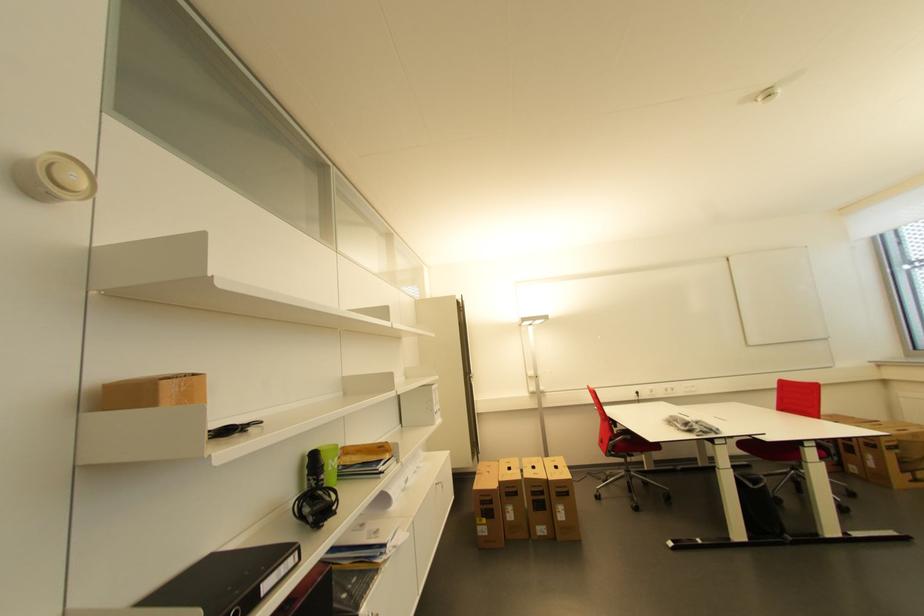
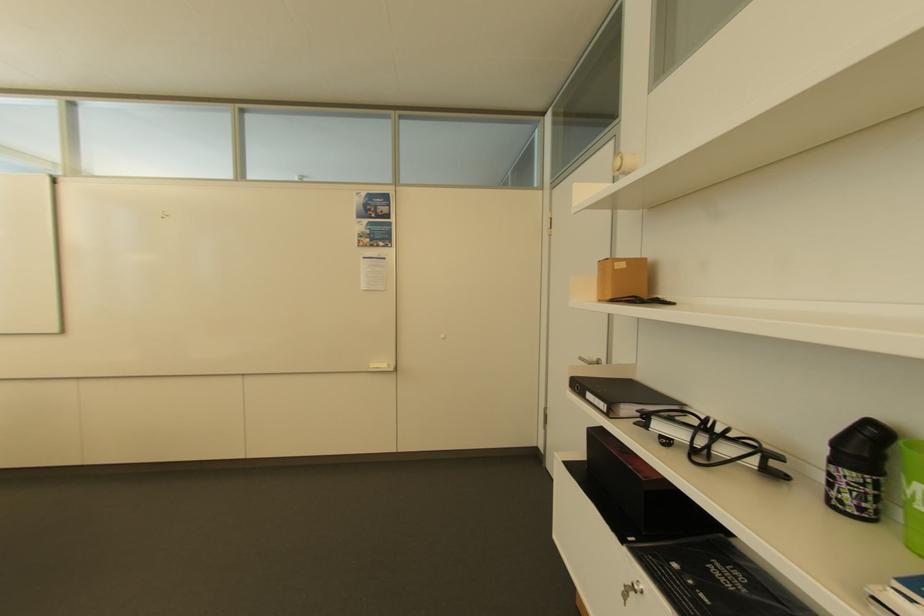
Find the pixel in the second image that matches point 339,466 in the first image.

(916, 493)